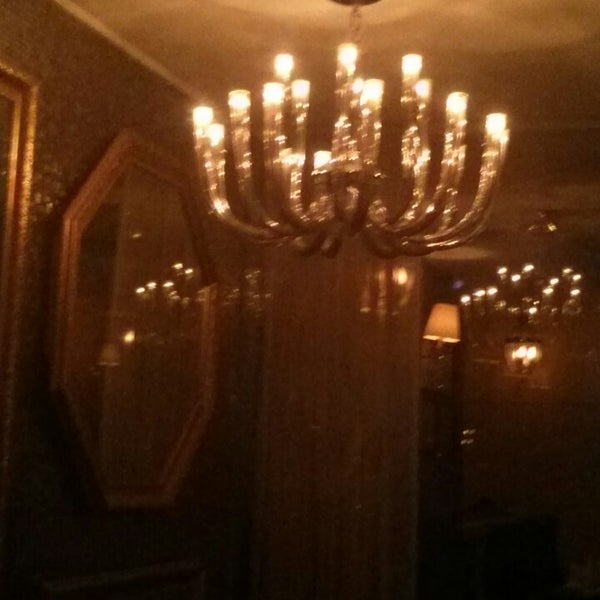
Locate an element on the screen. The image size is (600, 600). lamp is located at coordinates (438, 317).